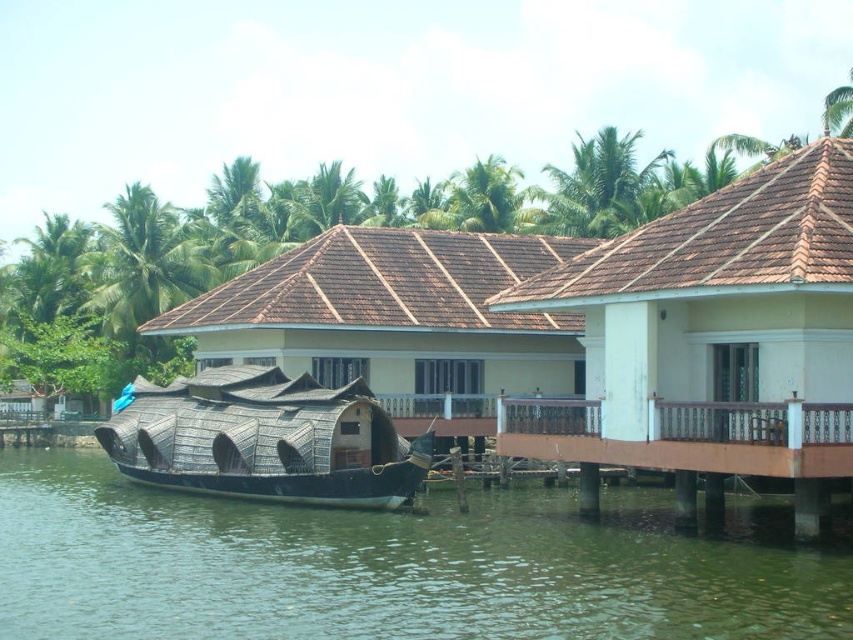
Question: Does white painted wood house at center appear on the left side of rattan-thatched hut at center?

Choices:
 (A) yes
 (B) no

Answer: (B)

Question: Which point is closer to the camera taking this photo?

Choices:
 (A) (782, 324)
 (B) (105, 436)
 (C) (587, 621)

Answer: (C)

Question: Which object is positioned closest to the white painted wood house at center?

Choices:
 (A) rattan-thatched hut at center
 (B) green water at lower left

Answer: (B)

Question: Does green water at lower left appear over white painted wood house at center?

Choices:
 (A) no
 (B) yes

Answer: (A)

Question: Which object is farther from the camera taking this photo?

Choices:
 (A) white painted wood house at center
 (B) rattan-thatched hut at center
 (C) green water at lower left

Answer: (B)

Question: Is white painted wood house at center thinner than black woven boat at center?

Choices:
 (A) no
 (B) yes

Answer: (B)